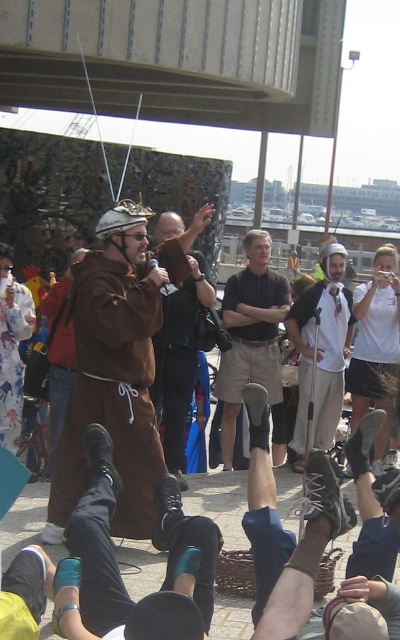
Question: Is white cotton shirt at center below brown leather jacket at center?

Choices:
 (A) no
 (B) yes

Answer: (B)

Question: Which point is farther to the camera?

Choices:
 (A) (229, 422)
 (B) (334, 346)
 (C) (66, 474)

Answer: (A)

Question: Is dark brown shirt at center above brown leather jacket at center?

Choices:
 (A) no
 (B) yes

Answer: (B)

Question: Among these objects, which one is nearest to the camera?

Choices:
 (A) brown leather robe at center
 (B) dark brown shirt at center

Answer: (A)

Question: Which of the following is the farthest from the observer?

Choices:
 (A) (256, 282)
 (B) (160, 285)
 (C) (306, 422)

Answer: (A)

Question: Is white cotton shirt at center bigger than brown leather jacket at center?

Choices:
 (A) yes
 (B) no

Answer: (B)